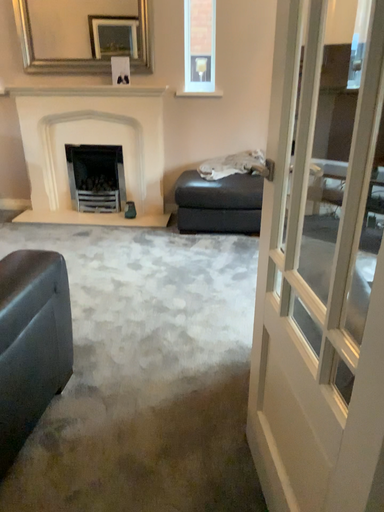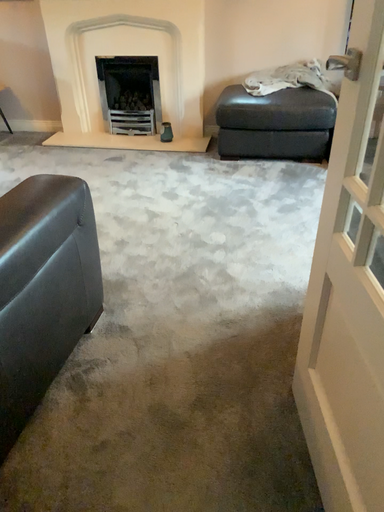
Question: How did the camera likely rotate when shooting the video?

Choices:
 (A) rotated downward
 (B) rotated upward

Answer: (A)